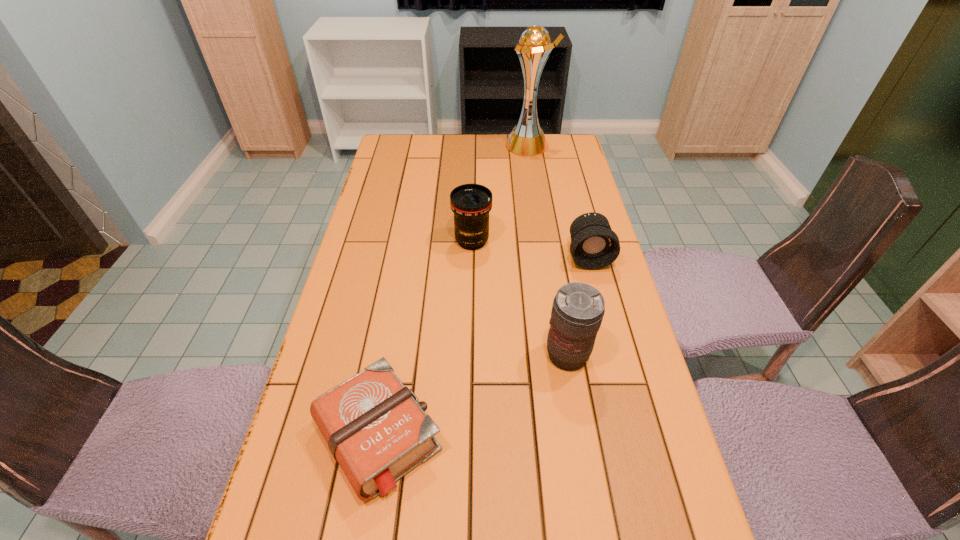
The image size is (960, 540). What are the coordinates of `free space between the fourth farthest object and the second shortest telephoto lens` in the screenshot? It's located at (519, 299).

This screenshot has height=540, width=960. I want to click on free space that is in between the shortest object and the tallest object, so pos(453,291).

Choose which object is the second nearest neighbor to the fourth tallest object. Please provide its 2D coordinates. Your answer should be formatted as a tuple, i.e. [(x, y)], where the tuple contains the x and y coordinates of a point satisfying the conditions above.

[(578, 308)]

Locate which object is the third closest to the shortest object. Please provide its 2D coordinates. Your answer should be formatted as a tuple, i.e. [(x, y)], where the tuple contains the x and y coordinates of a point satisfying the conditions above.

[(594, 245)]

Image resolution: width=960 pixels, height=540 pixels. I want to click on telephoto lens that is the closest to the second nearest object, so click(x=594, y=245).

Point out which telephoto lens is positioned as the nearest to the Bible. Please provide its 2D coordinates. Your answer should be formatted as a tuple, i.e. [(x, y)], where the tuple contains the x and y coordinates of a point satisfying the conditions above.

[(578, 308)]

Find the location of a particular element. free location that satisfies the following two spatial constraints: 1. on the back side of the nearest object; 2. on the left side of the second tallest telephoto lens is located at coordinates (412, 241).